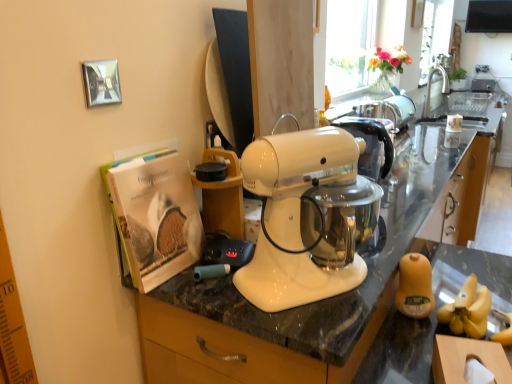
Question: From the image's perspective, would you say silver metallic faucet at upper right is positioned over white glossy countertop at center?

Choices:
 (A) no
 (B) yes

Answer: (B)

Question: Considering the relative sizes of silver metallic faucet at upper right and white glossy countertop at center in the image provided, is silver metallic faucet at upper right shorter than white glossy countertop at center?

Choices:
 (A) no
 (B) yes

Answer: (B)

Question: From a real-world perspective, is silver metallic faucet at upper right on top of white glossy countertop at center?

Choices:
 (A) no
 (B) yes

Answer: (B)

Question: Is silver metallic faucet at upper right oriented away from white glossy countertop at center?

Choices:
 (A) no
 (B) yes

Answer: (A)

Question: From the image's perspective, is silver metallic faucet at upper right under white glossy countertop at center?

Choices:
 (A) no
 (B) yes

Answer: (A)

Question: Is silver metallic faucet at upper right at the right side of white glossy countertop at center?

Choices:
 (A) no
 (B) yes

Answer: (B)

Question: Does yellow matte jar at lower right appear on the right side of silver metallic faucet at upper right?

Choices:
 (A) no
 (B) yes

Answer: (A)

Question: From a real-world perspective, does yellow matte jar at lower right stand above silver metallic faucet at upper right?

Choices:
 (A) yes
 (B) no

Answer: (B)

Question: Is yellow matte jar at lower right positioned in front of silver metallic faucet at upper right?

Choices:
 (A) yes
 (B) no

Answer: (A)

Question: From the image's perspective, is yellow matte jar at lower right on top of silver metallic faucet at upper right?

Choices:
 (A) yes
 (B) no

Answer: (B)

Question: Is yellow matte jar at lower right positioned far away from silver metallic faucet at upper right?

Choices:
 (A) yes
 (B) no

Answer: (A)

Question: Is yellow matte jar at lower right thinner than silver metallic faucet at upper right?

Choices:
 (A) no
 (B) yes

Answer: (B)

Question: From a real-world perspective, is white glossy countertop at center over yellow matte jar at lower right?

Choices:
 (A) no
 (B) yes

Answer: (A)